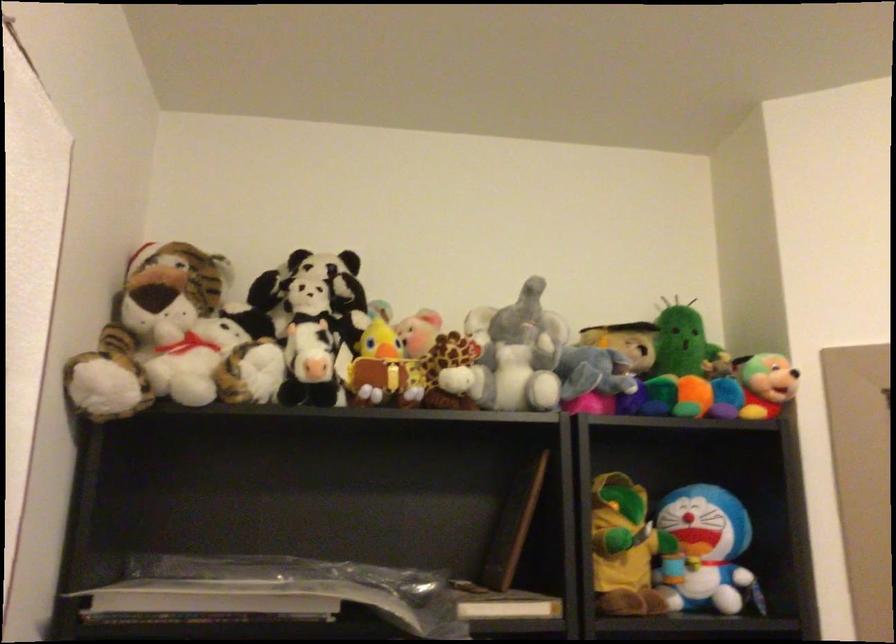
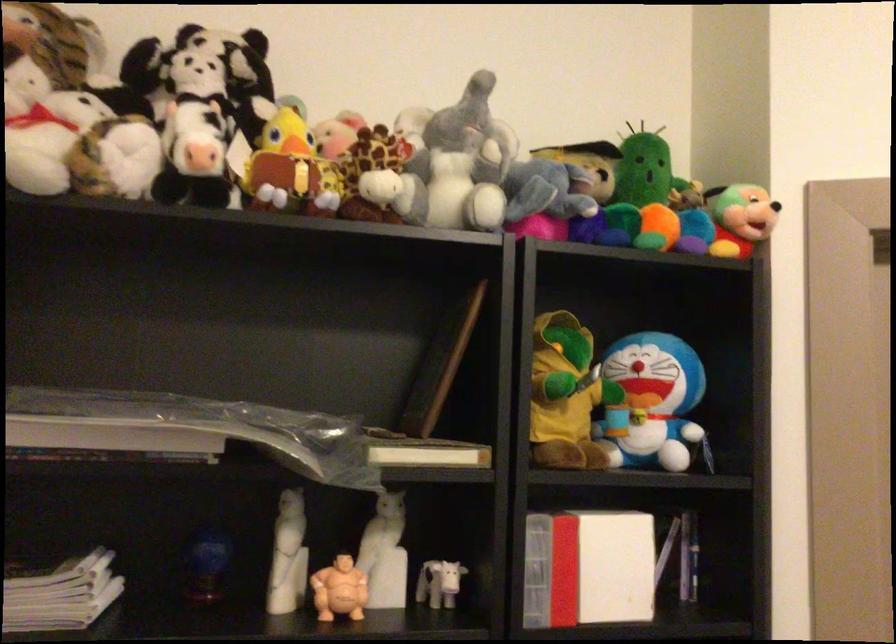
Question: Which direction would the cameraman need to move to produce the second image? Reply with the corresponding letter.

Choices:
 (A) Left
 (B) Right
 (C) Forward
 (D) Backward

Answer: (C)